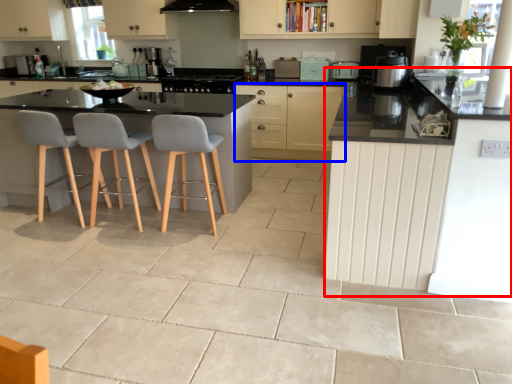
Question: Which of the following is the closest to the observer, counter (highlighted by a red box) or cabinetry (highlighted by a blue box)?

Choices:
 (A) counter
 (B) cabinetry

Answer: (A)